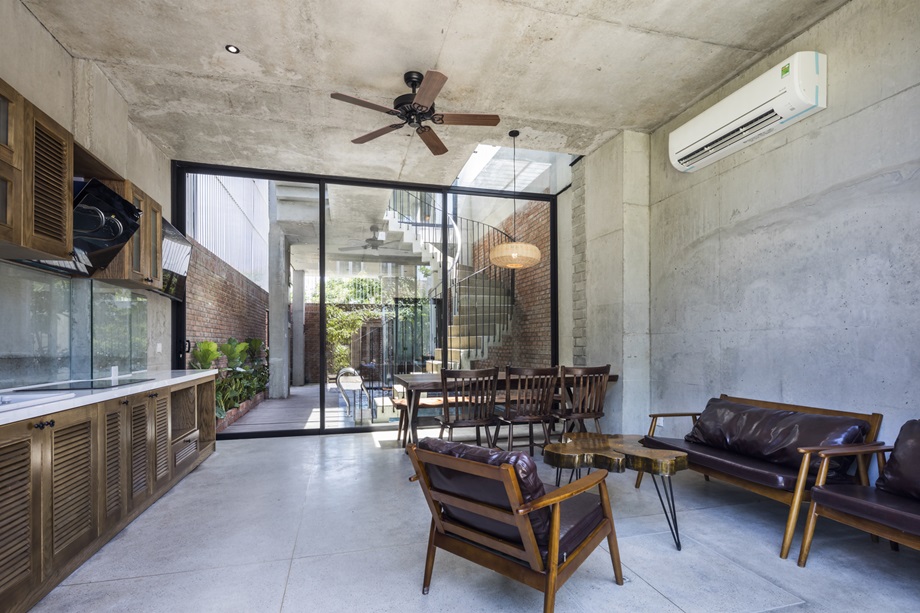
I want to click on brown fan blades, so click(x=431, y=84), click(x=462, y=116), click(x=433, y=147), click(x=371, y=138), click(x=357, y=102).